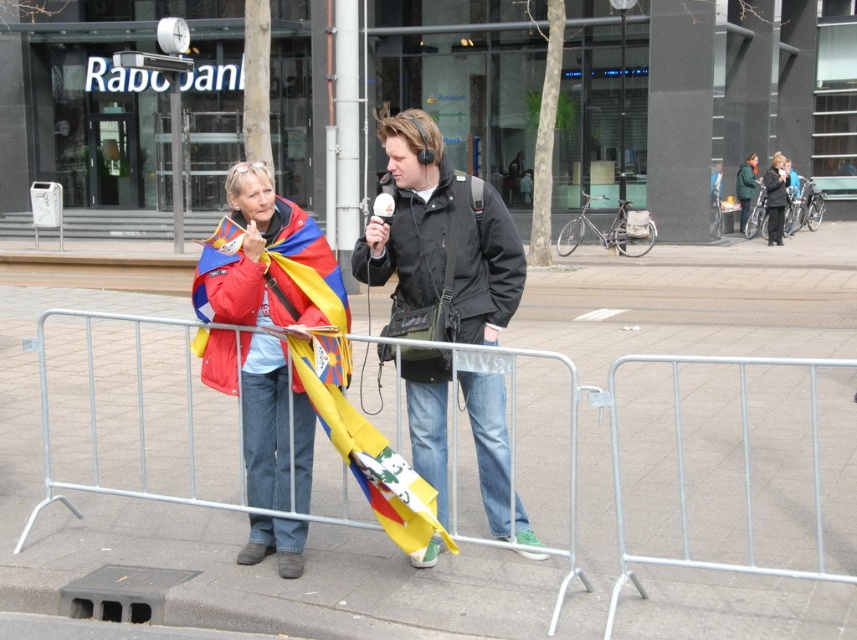
You are standing at the origin point in the image. The yellow fabric flag at center is represented by point (x=366, y=445). Which direction should you move to reach the yellow fabric flag at center?

To reach the yellow fabric flag at center, you should move towards the point with coordinates (x=366, y=445), which is located at the center of the image.

You are a photographer trying to capture both the yellow fabric flag at center and the dark green jacket at center in a single frame. Which object should you focus on first to ensure both are in the frame?

The yellow fabric flag at center is smaller than the dark green jacket at center, so you should focus on the yellow fabric flag at center first to ensure it is centered and in frame before adjusting for the larger dark green jacket at center.